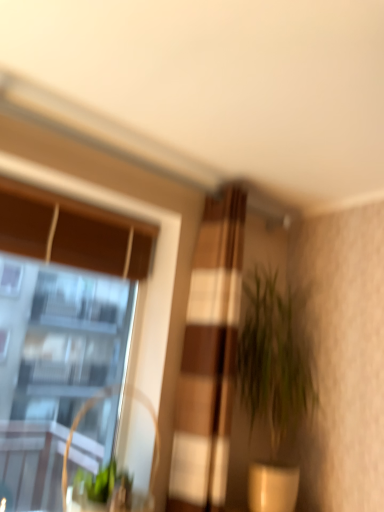
Question: From a real-world perspective, is clear glass window at upper left positioned under textured beige curtain at center based on gravity?

Choices:
 (A) yes
 (B) no

Answer: (A)

Question: Considering the relative sizes of clear glass window at upper left and textured beige curtain at center in the image provided, is clear glass window at upper left thinner than textured beige curtain at center?

Choices:
 (A) no
 (B) yes

Answer: (B)

Question: From a real-world perspective, is clear glass window at upper left on top of textured beige curtain at center?

Choices:
 (A) yes
 (B) no

Answer: (B)

Question: Is clear glass window at upper left at the right side of textured beige curtain at center?

Choices:
 (A) no
 (B) yes

Answer: (A)

Question: Is clear glass window at upper left directly adjacent to textured beige curtain at center?

Choices:
 (A) yes
 (B) no

Answer: (B)

Question: Is there a large distance between clear glass window at upper left and textured beige curtain at center?

Choices:
 (A) yes
 (B) no

Answer: (A)

Question: Is metallic silver swivel chair at left smaller than textured beige curtain at center?

Choices:
 (A) no
 (B) yes

Answer: (B)

Question: From a real-world perspective, does metallic silver swivel chair at left stand above textured beige curtain at center?

Choices:
 (A) no
 (B) yes

Answer: (A)

Question: Does metallic silver swivel chair at left have a greater height compared to textured beige curtain at center?

Choices:
 (A) no
 (B) yes

Answer: (A)

Question: From the image's perspective, is metallic silver swivel chair at left on top of textured beige curtain at center?

Choices:
 (A) no
 (B) yes

Answer: (A)

Question: Is metallic silver swivel chair at left with textured beige curtain at center?

Choices:
 (A) no
 (B) yes

Answer: (A)

Question: Can you confirm if metallic silver swivel chair at left is thinner than textured beige curtain at center?

Choices:
 (A) yes
 (B) no

Answer: (B)

Question: From the image's perspective, is green leafy plant at center-right over textured beige curtain at center?

Choices:
 (A) yes
 (B) no

Answer: (B)